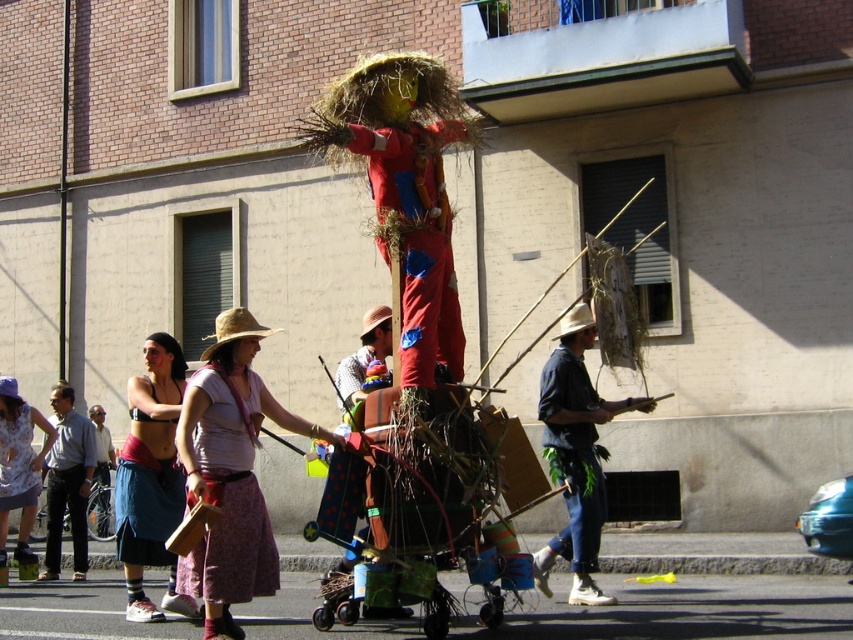
Based on the scene description, where is the matte gray shirt at center located in terms of its 2D coordinates?

The matte gray shirt at center is located at the 2D coordinates point (67,481).